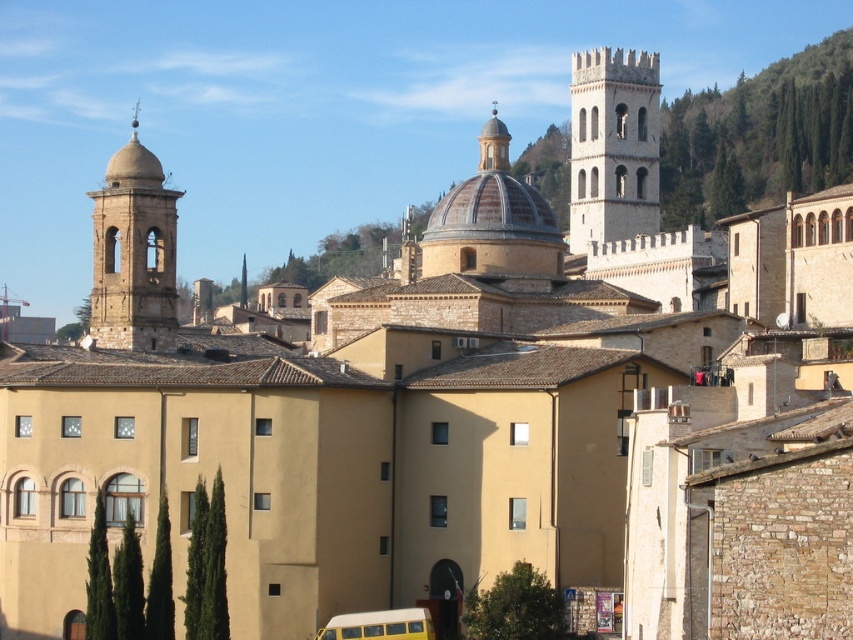
Question: Among these points, which one is farthest from the camera?

Choices:
 (A) (146, 336)
 (B) (374, 620)

Answer: (A)

Question: Considering the real-world distances, which object is farthest from the yellow matte school bus at lower center?

Choices:
 (A) smooth stone bell tower at left
 (B) stone tower at upper right

Answer: (B)

Question: Which point is farther to the camera?

Choices:
 (A) stone tower at upper right
 (B) yellow matte school bus at lower center

Answer: (A)

Question: From the image, what is the correct spatial relationship of stone tower at upper right in relation to yellow matte school bus at lower center?

Choices:
 (A) above
 (B) below

Answer: (A)

Question: From the image, what is the correct spatial relationship of smooth stone bell tower at left in relation to yellow matte school bus at lower center?

Choices:
 (A) right
 (B) left

Answer: (B)

Question: Is stone tower at upper right bigger than smooth stone bell tower at left?

Choices:
 (A) yes
 (B) no

Answer: (B)